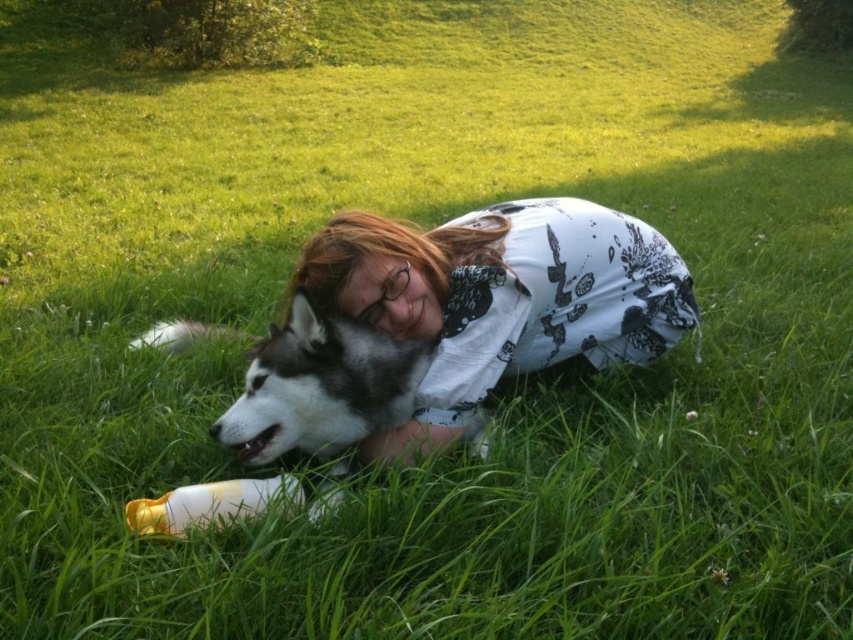
Which of these two, white printed shirt at center or gray-black fur dog at center, stands taller?

white printed shirt at center is taller.

Describe the element at coordinates (498, 298) in the screenshot. I see `white printed shirt at center` at that location.

In order to click on white printed shirt at center in this screenshot , I will do `click(498, 298)`.

From the picture: Can you confirm if white printed shirt at center is shorter than yellow plastic bottle at lower left?

A: Incorrect, white printed shirt at center's height does not fall short of yellow plastic bottle at lower left's.

Can you confirm if white printed shirt at center is positioned above yellow plastic bottle at lower left?

Correct, white printed shirt at center is located above yellow plastic bottle at lower left.

Measure the distance between white printed shirt at center and camera.

white printed shirt at center is 6.31 feet away from camera.

Locate an element on the screen. The height and width of the screenshot is (640, 853). white printed shirt at center is located at coordinates (498, 298).

Measure the distance between point (297, 388) and camera.

Point (297, 388) and camera are 1.97 meters apart from each other.

Between gray-black fur dog at center and yellow plastic bottle at lower left, which one has less height?

Standing shorter between the two is yellow plastic bottle at lower left.

Is point (294, 340) farther from viewer compared to point (231, 483)?

Yes, it is behind point (231, 483).

The width and height of the screenshot is (853, 640). Find the location of `gray-black fur dog at center`. gray-black fur dog at center is located at coordinates (320, 387).